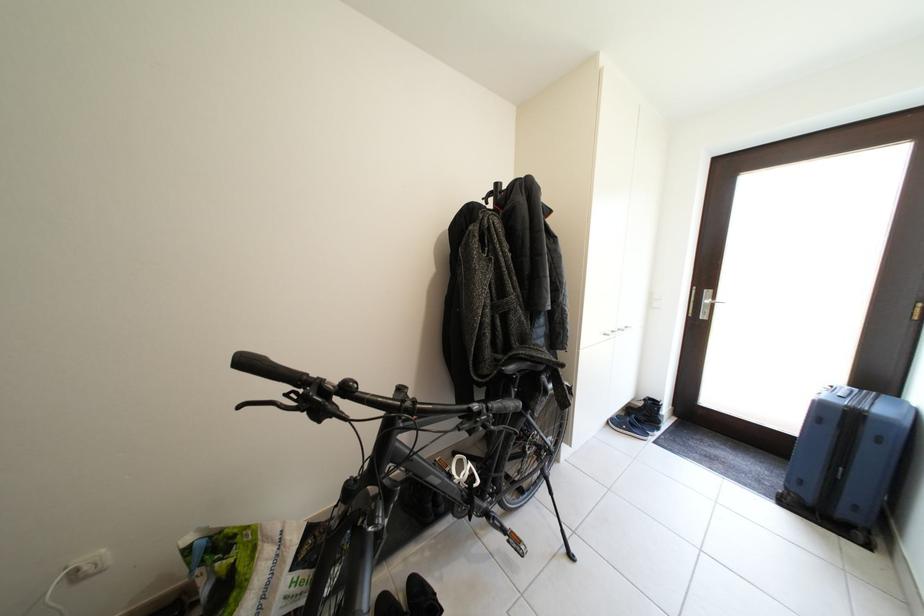
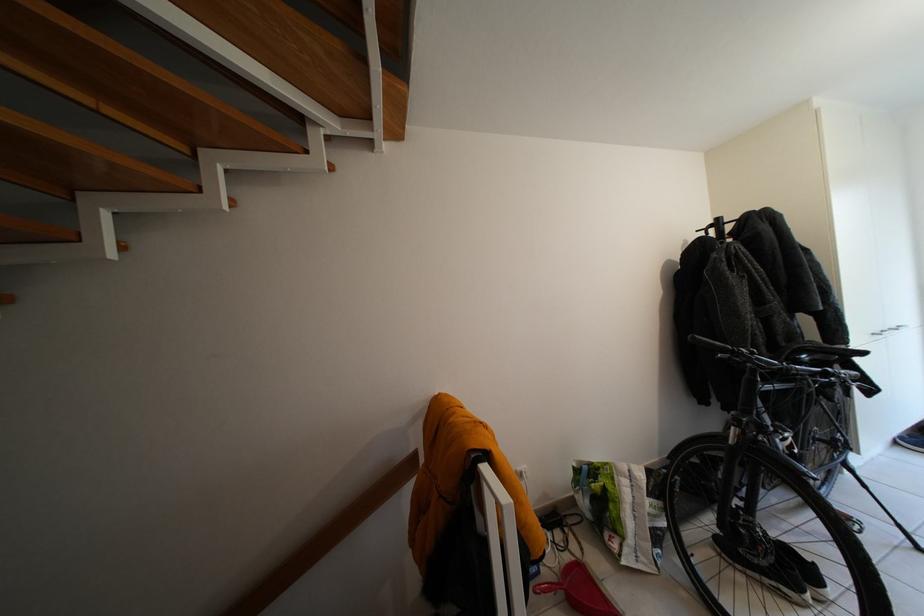
In the second image, find the point that corresponds to point (550, 369) in the first image.

(841, 360)